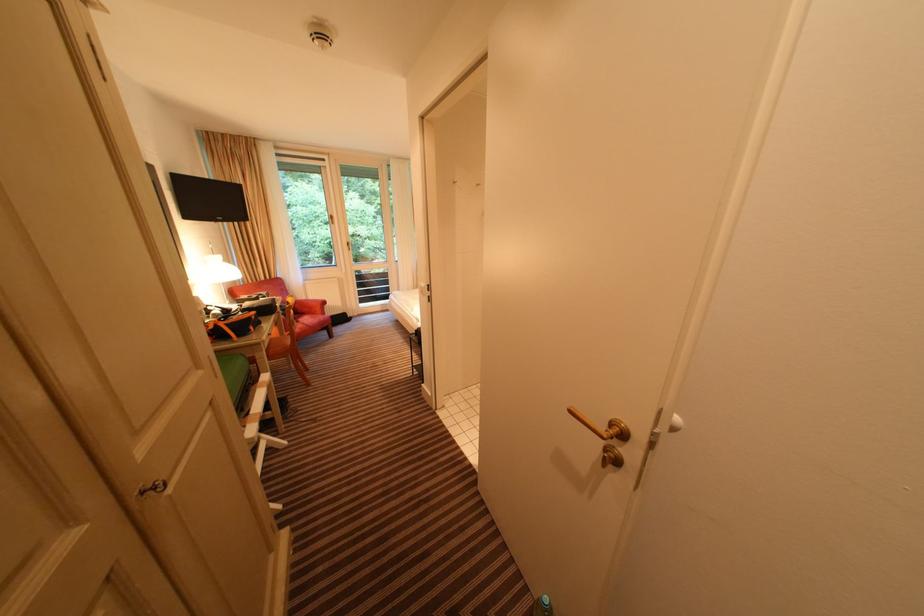
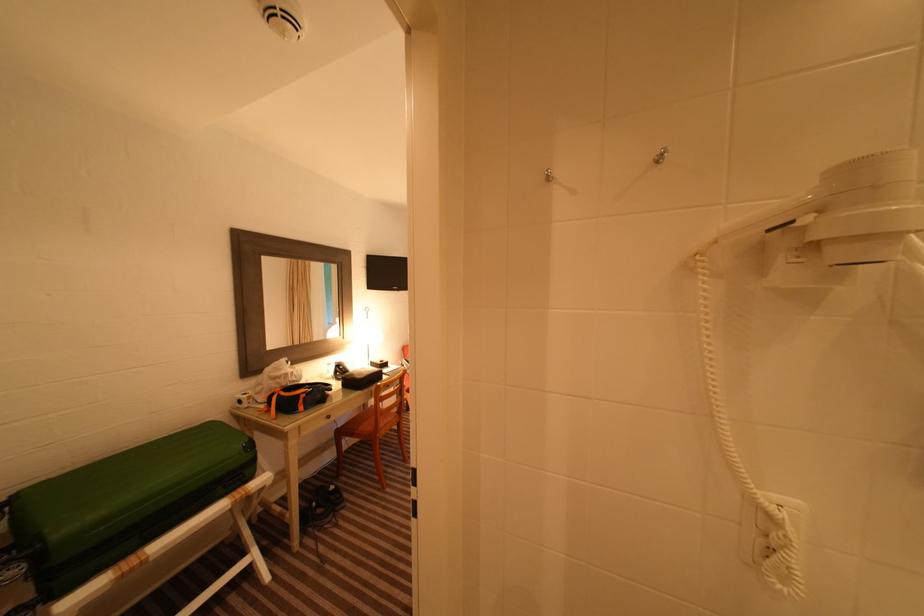
Where in the second image is the point corresponding to (223,328) from the first image?

(280, 397)